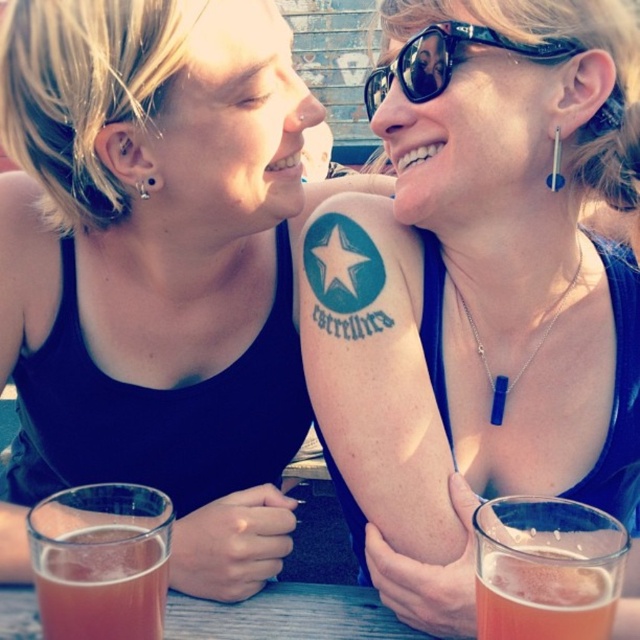
In the scene shown: Based on the scene described, which object is larger in size between the matte black tank top at upper center and the translucent glass at lower left?

The translucent glass at lower left is larger than the matte black tank top at upper center.

You are a photographer standing at the center of the scene. You want to take a photo that includes both the translucent glass at lower left and the translucent glass at lower right. What is the minimum distance you need to move backward to ensure both glasses are in frame?

The translucent glass at lower left is 7.77 feet away from the translucent glass at lower right. To include both in the frame, you need to move backward until you are at least 7.77 feet away from the closer glass. However, the exact distance depends on your camera lens and sensor size. Assuming a standard lens with a 50mm focal length, you would need to move back approximately 3.88 feet from the midpoint between the two glasses, which would place you about 5.88 feet from the farther glass. But since the mid